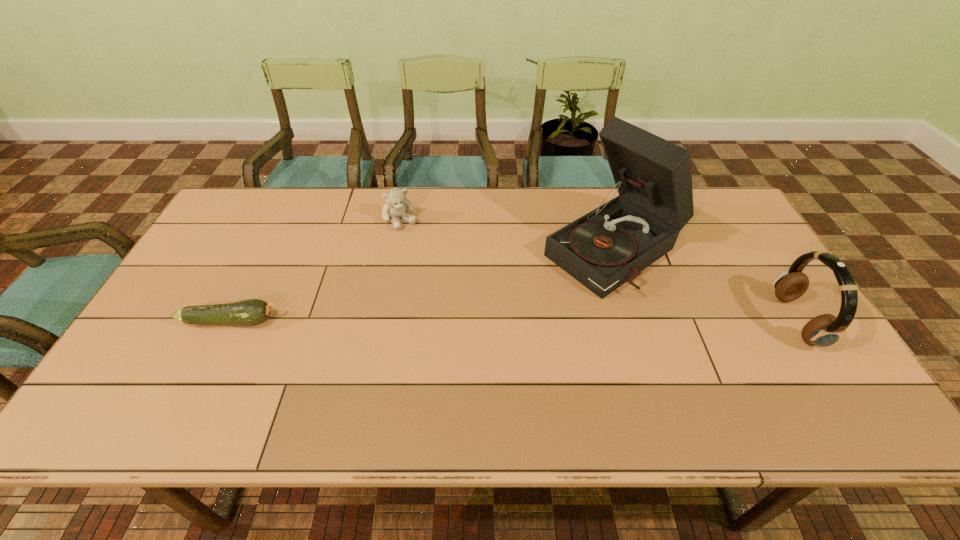
Locate an element on the screen. The height and width of the screenshot is (540, 960). vacant space on the desktop that is between the shortest object and the rightmost object and is positioned on the front-facing side of the third object from left to right is located at coordinates (504, 321).

The width and height of the screenshot is (960, 540). What are the coordinates of `free spot on the desktop that is between the zucchini and the second tallest object and is positioned on the face of the third tallest object` in the screenshot? It's located at (468, 321).